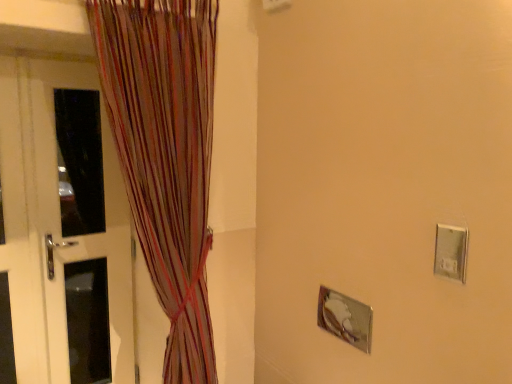
Question: Should I look upward or downward to see white glossy door at left?

Choices:
 (A) up
 (B) down

Answer: (B)

Question: Are white glossy door at left and multicolored striped curtain at left beside each other?

Choices:
 (A) no
 (B) yes

Answer: (A)

Question: Is white glossy door at left far away from multicolored striped curtain at left?

Choices:
 (A) no
 (B) yes

Answer: (A)

Question: Considering the relative positions of white glossy door at left and multicolored striped curtain at left in the image provided, is white glossy door at left behind multicolored striped curtain at left?

Choices:
 (A) no
 (B) yes

Answer: (B)

Question: From a real-world perspective, is white glossy door at left beneath multicolored striped curtain at left?

Choices:
 (A) no
 (B) yes

Answer: (B)

Question: Is white glossy door at left to the left of multicolored striped curtain at left from the viewer's perspective?

Choices:
 (A) no
 (B) yes

Answer: (B)

Question: Is white glossy door at left outside of multicolored striped curtain at left?

Choices:
 (A) no
 (B) yes

Answer: (B)

Question: From the image's perspective, is silver metallic electric outlet at right located beneath white glossy door at left?

Choices:
 (A) yes
 (B) no

Answer: (B)

Question: Could you tell me if silver metallic electric outlet at right is turned towards white glossy door at left?

Choices:
 (A) yes
 (B) no

Answer: (B)

Question: Does silver metallic electric outlet at right lie behind white glossy door at left?

Choices:
 (A) yes
 (B) no

Answer: (B)

Question: Can you confirm if silver metallic electric outlet at right is smaller than white glossy door at left?

Choices:
 (A) no
 (B) yes

Answer: (B)

Question: Could white glossy door at left be considered to be inside silver metallic electric outlet at right?

Choices:
 (A) yes
 (B) no

Answer: (B)

Question: Is silver metallic electric outlet at right completely or partially outside of white glossy door at left?

Choices:
 (A) yes
 (B) no

Answer: (A)

Question: Does white glossy door at left lie in front of silver metallic electric outlet at right?

Choices:
 (A) no
 (B) yes

Answer: (A)